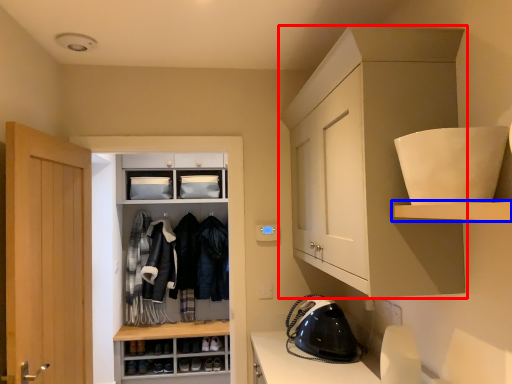
Question: Which object is further to the camera taking this photo, cabinetry (highlighted by a red box) or shelf (highlighted by a blue box)?

Choices:
 (A) cabinetry
 (B) shelf

Answer: (A)